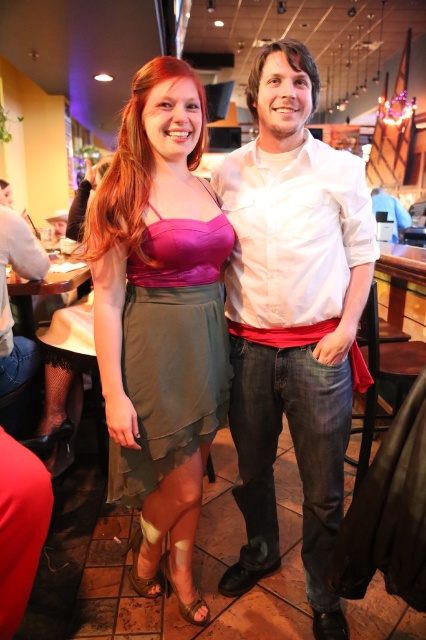
Looking at this image, you are a photographer setting up for a group photo. You notice the white cotton shirt at center and the satin pink top at center in the scene. Which clothing item has a wider width?

The white cotton shirt at center has a wider width than the satin pink top at center according to the description.

You are standing in the bar and want to take a photo of the white cotton shirt at center. Where should you position yourself to capture it in the frame?

The white cotton shirt at center is located at point (293, 317), so position yourself directly facing the center of the image to capture it.

You are a photographer in this scene and want to ensure both the satin pink top at center and the satin green skirt at center are clearly visible in your photo. Based on their positions, which one is more likely to be fully visible without obstruction?

The satin pink top at center is much taller than the satin green skirt at center, so it is more likely to be fully visible without obstruction.